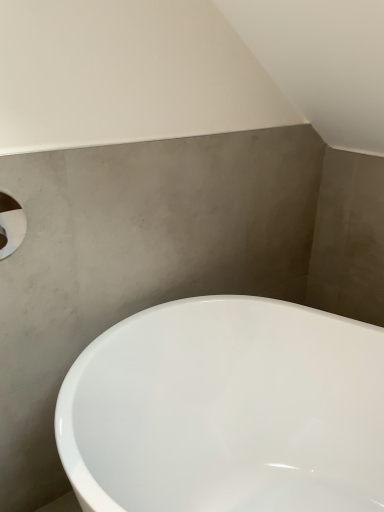
This screenshot has height=512, width=384. What do you see at coordinates (226, 410) in the screenshot? I see `white glossy bathtub at center` at bounding box center [226, 410].

The height and width of the screenshot is (512, 384). What are the coordinates of `white glossy bathtub at center` in the screenshot? It's located at (226, 410).

Locate an element on the screen. white glossy bathtub at center is located at coordinates (226, 410).